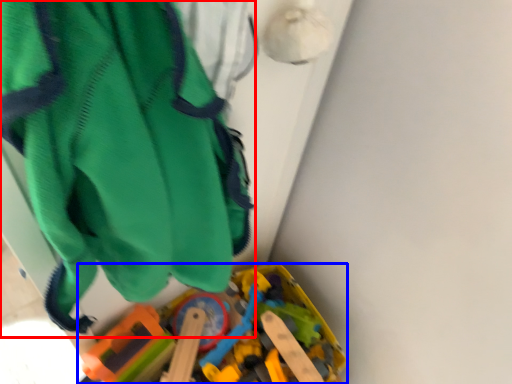
Question: Which of the following is the farthest to the observer, wide (highlighted by a red box) or toy (highlighted by a blue box)?

Choices:
 (A) wide
 (B) toy

Answer: (B)